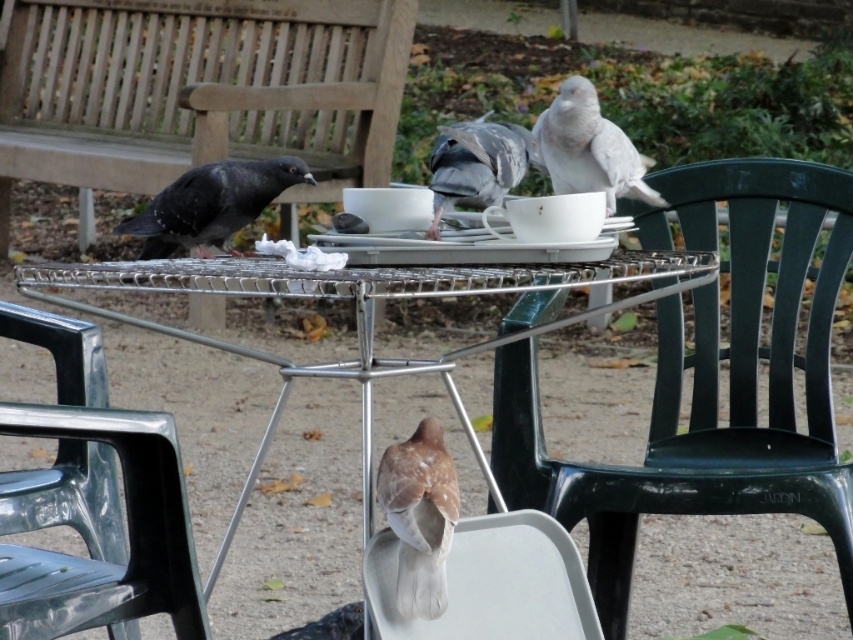
You are standing at the point labeled as point (363, 323) in the image. What object are you standing on?

The point (363, 323) indicates the metallic silver table at center, so you are standing on the metallic silver table at center.

You are a park visitor who wants to place a small basket on the metallic silver table at center without disturbing the dark gray feathers at left. Is the table big enough to accommodate the basket?

The metallic silver table at center is larger in size than dark gray feathers at left, so yes, the table is big enough to place the basket without disturbing the dark gray feathers at left.